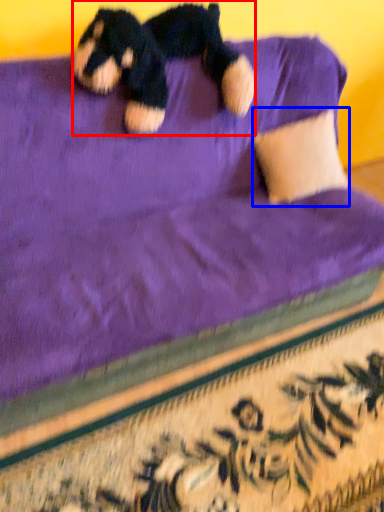
Question: Which object appears closest to the camera in this image, teddy bear (highlighted by a red box) or pillow (highlighted by a blue box)?

Choices:
 (A) teddy bear
 (B) pillow

Answer: (A)